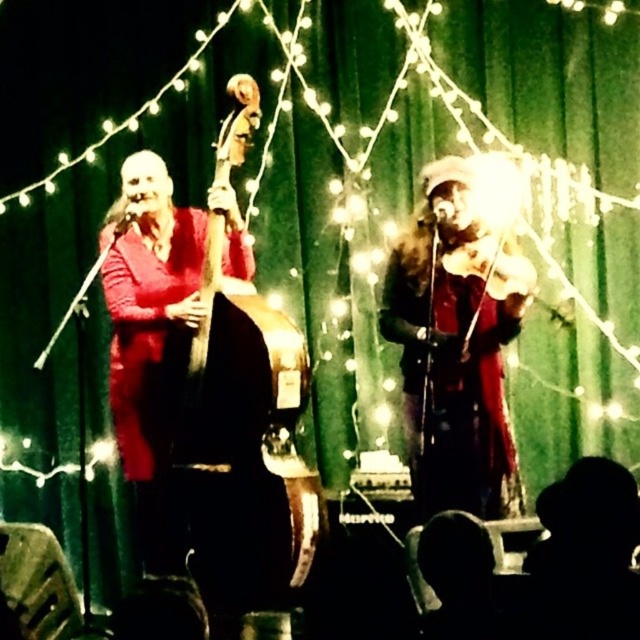
Question: Does wooden polished cello at left appear on the right side of shiny red coat at center?

Choices:
 (A) yes
 (B) no

Answer: (B)

Question: Which point appears farthest from the camera in this image?

Choices:
 (A) (257, 84)
 (B) (461, 506)

Answer: (A)

Question: Does wooden polished cello at left lie behind shiny red coat at center?

Choices:
 (A) yes
 (B) no

Answer: (B)

Question: Which of the following is the closest to the observer?

Choices:
 (A) (304, 481)
 (B) (483, 381)

Answer: (A)

Question: In this image, where is wooden polished cello at left located relative to shiny red coat at center?

Choices:
 (A) below
 (B) above

Answer: (A)